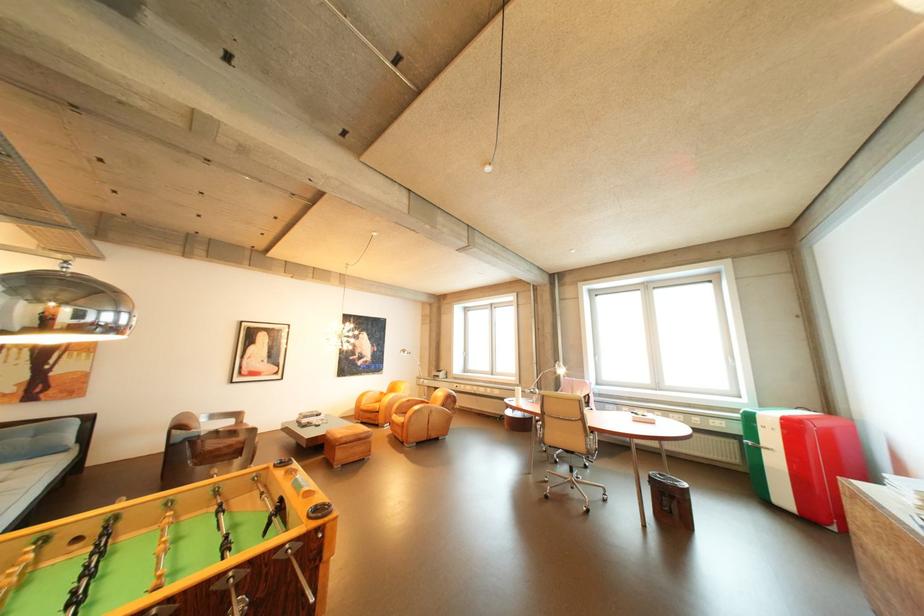
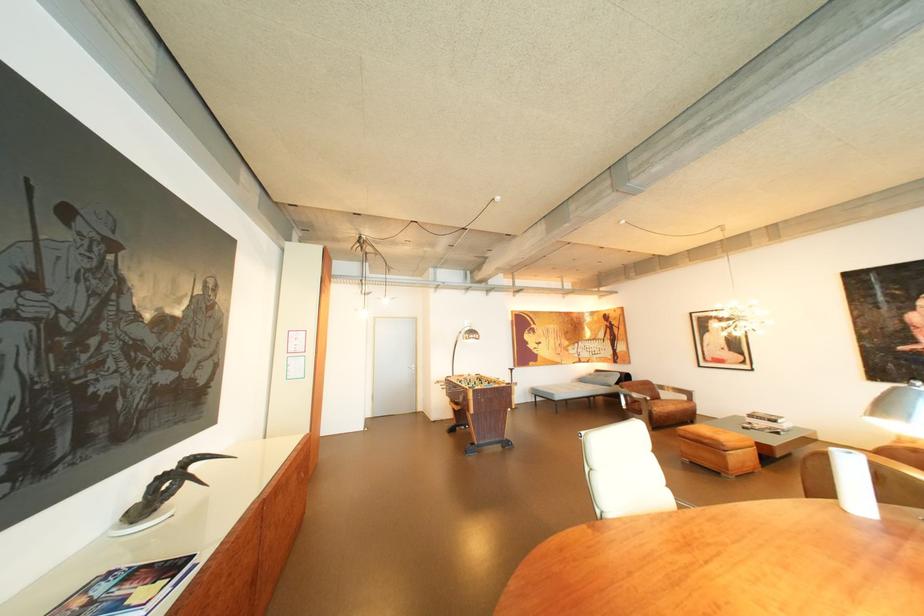
Locate, in the second image, the point that corresponds to the point at 319,418 in the first image.

(763, 416)